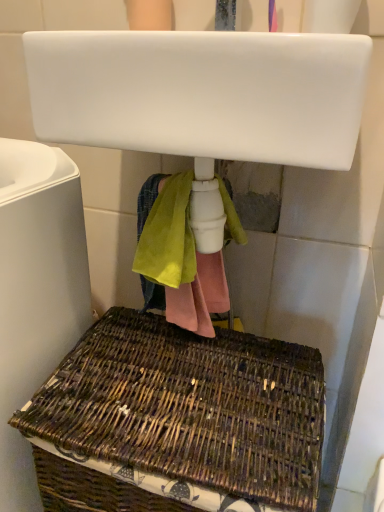
Question: From a real-world perspective, is woven brown basket at lower left below brown woven picnic basket at lower center?

Choices:
 (A) no
 (B) yes

Answer: (A)

Question: Does woven brown basket at lower left have a greater height compared to brown woven picnic basket at lower center?

Choices:
 (A) yes
 (B) no

Answer: (A)

Question: Is brown woven picnic basket at lower center at the back of woven brown basket at lower left?

Choices:
 (A) no
 (B) yes

Answer: (A)

Question: From the image's perspective, is woven brown basket at lower left located above brown woven picnic basket at lower center?

Choices:
 (A) no
 (B) yes

Answer: (B)

Question: Is woven brown basket at lower left behind brown woven picnic basket at lower center?

Choices:
 (A) yes
 (B) no

Answer: (B)

Question: Is woven brown basket at lower left to the left of brown woven picnic basket at lower center from the viewer's perspective?

Choices:
 (A) no
 (B) yes

Answer: (B)

Question: Does brown woven picnic basket at lower center appear on the left side of woven brown basket at lower left?

Choices:
 (A) yes
 (B) no

Answer: (B)

Question: Can you confirm if brown woven picnic basket at lower center is smaller than woven brown basket at lower left?

Choices:
 (A) no
 (B) yes

Answer: (B)

Question: Is brown woven picnic basket at lower center at the right side of woven brown basket at lower left?

Choices:
 (A) yes
 (B) no

Answer: (A)

Question: Does brown woven picnic basket at lower center have a larger size compared to woven brown basket at lower left?

Choices:
 (A) yes
 (B) no

Answer: (B)

Question: Is brown woven picnic basket at lower center turned away from woven brown basket at lower left?

Choices:
 (A) no
 (B) yes

Answer: (A)

Question: From a real-world perspective, is brown woven picnic basket at lower center on top of woven brown basket at lower left?

Choices:
 (A) no
 (B) yes

Answer: (A)

Question: Is white glossy sink at upper center inside woven brown basket at lower left?

Choices:
 (A) no
 (B) yes

Answer: (A)